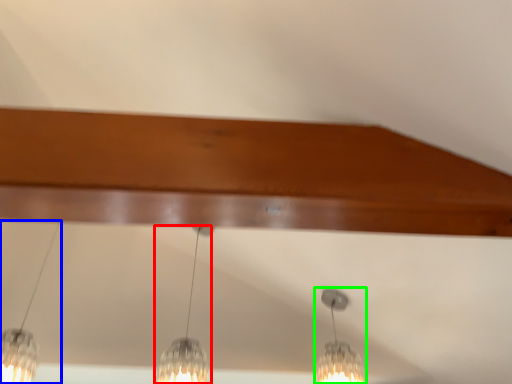
Question: Based on their relative distances, which object is farther from lamp (highlighted by a red box)? Choose from lamp (highlighted by a blue box) and lamp (highlighted by a green box).

Choices:
 (A) lamp
 (B) lamp

Answer: (B)